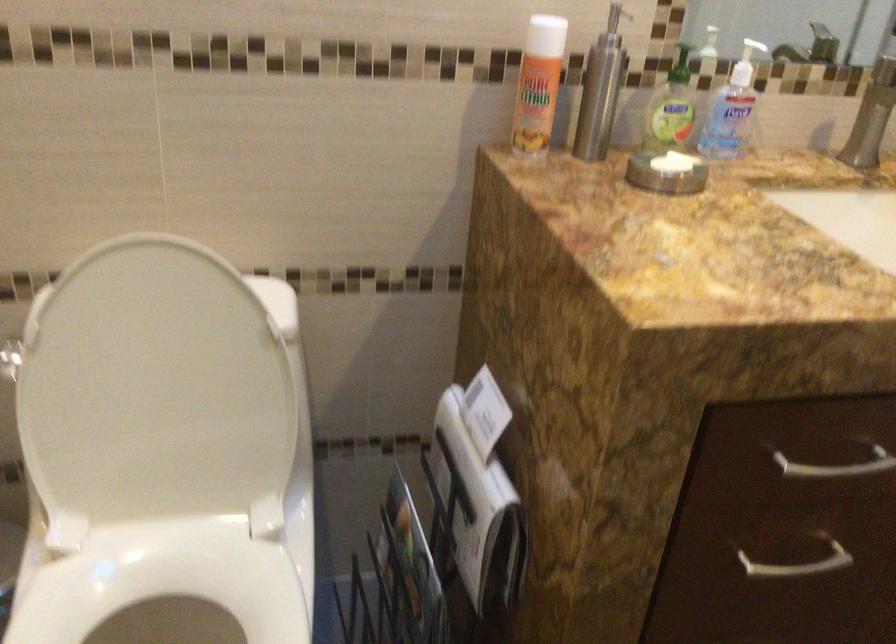
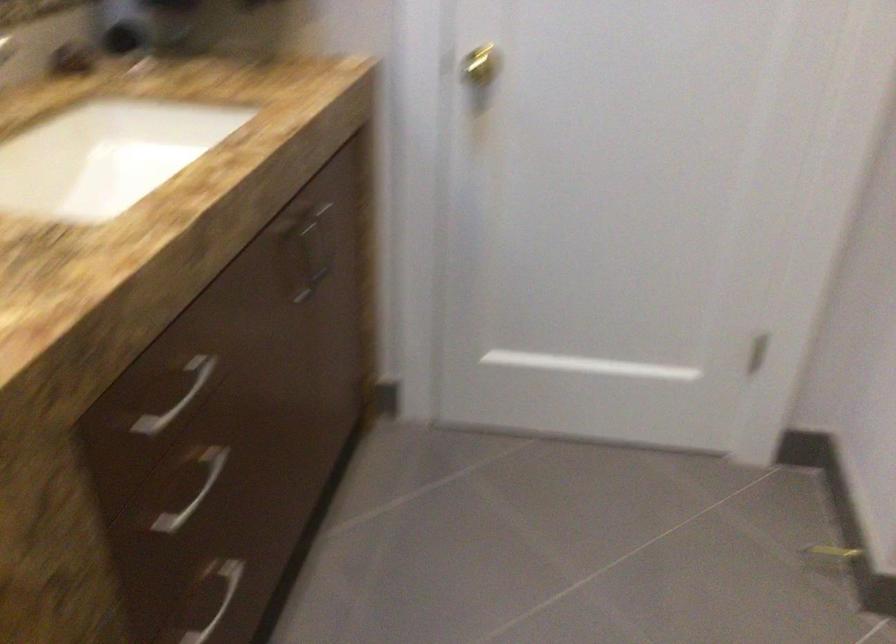
Where in the second image is the point corresponding to point (789, 554) from the first image?

(187, 488)